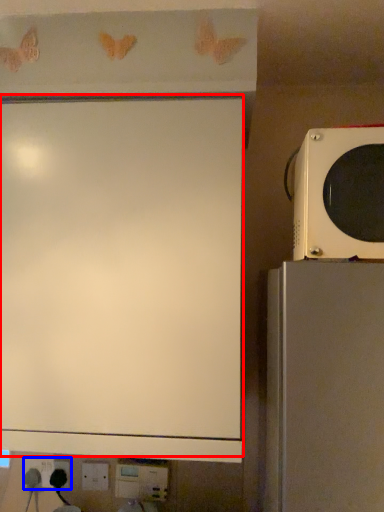
Question: Which object is closer to the camera taking this photo, projection screen (highlighted by a red box) or electric outlet (highlighted by a blue box)?

Choices:
 (A) projection screen
 (B) electric outlet

Answer: (A)